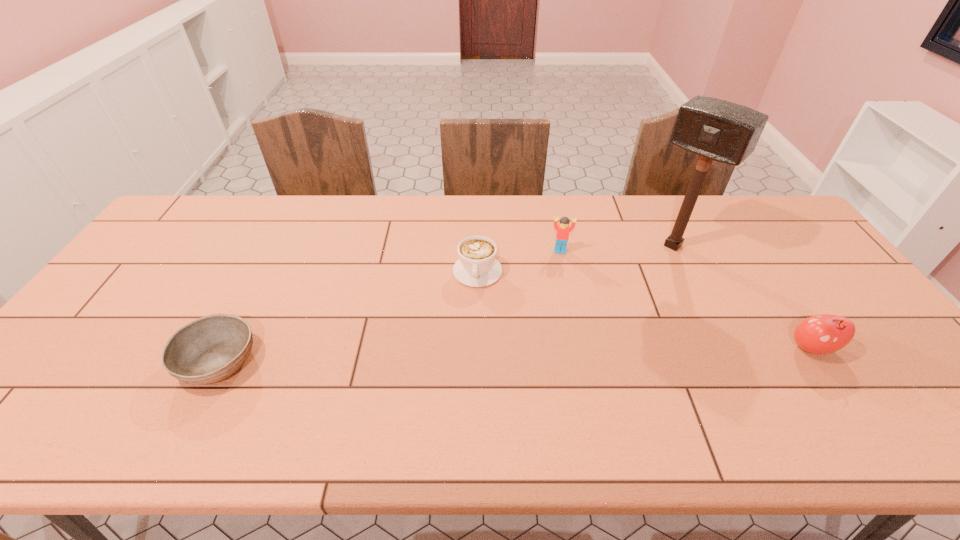
The image size is (960, 540). Find the location of `vacant position located 0.300m on the face of the Lego`. vacant position located 0.300m on the face of the Lego is located at coordinates click(x=562, y=329).

Locate an element on the screen. This screenshot has height=540, width=960. free space located on the face of the Lego is located at coordinates (561, 284).

The width and height of the screenshot is (960, 540). I want to click on vacant space positioned 0.270m on the face of the Lego, so click(562, 321).

You are a GUI agent. You are given a task and a screenshot of the screen. Output one action in this format:
    pyautogui.click(x=<x>, y=<y>)
    Task: Click on the free space located on the head of the tallest object
    Image resolution: width=960 pixels, height=540 pixels.
    Given the screenshot: What is the action you would take?
    pyautogui.click(x=632, y=286)

You are a GUI agent. You are given a task and a screenshot of the screen. Output one action in this format:
    pyautogui.click(x=<x>, y=<y>)
    Task: Click on the vacant point located 0.290m on the head of the tallest object
    
    Given the screenshot: What is the action you would take?
    pyautogui.click(x=605, y=312)

Where is `free space located on the head of the tallest object`? free space located on the head of the tallest object is located at coordinates (634, 284).

This screenshot has height=540, width=960. Find the location of `blank space located to the right of the second object from left to right's handle`. blank space located to the right of the second object from left to right's handle is located at coordinates (474, 323).

Locate an element on the screen. The image size is (960, 540). vacant space located to the right of the second object from left to right's handle is located at coordinates (473, 348).

At what (x,y) coordinates should I click in order to perform the action: click on vacant space located to the right of the second object from left to right's handle. Please return your answer as a coordinate pair (x, y). The height and width of the screenshot is (540, 960). Looking at the image, I should click on (474, 329).

Identify the location of object located at the far edge. The image size is (960, 540). (715, 129).